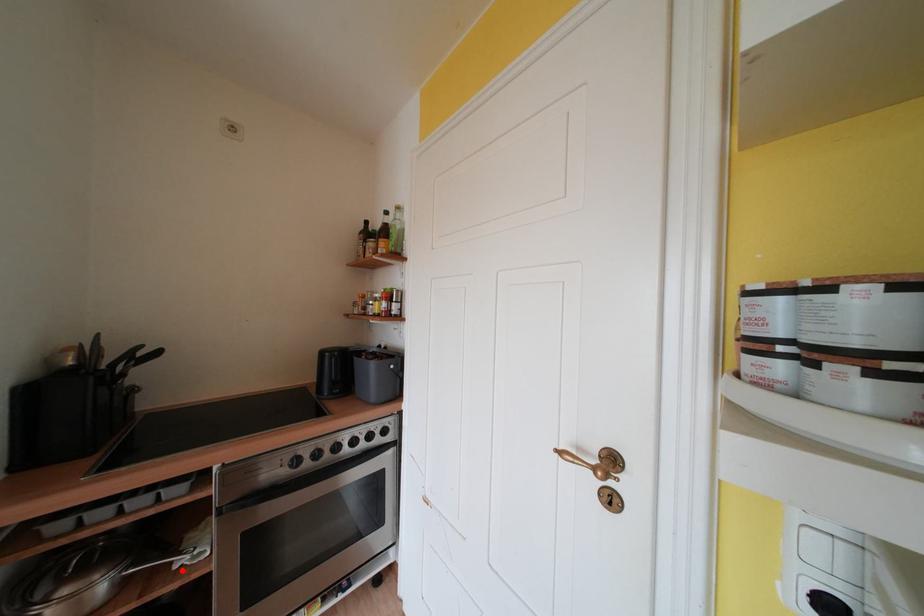
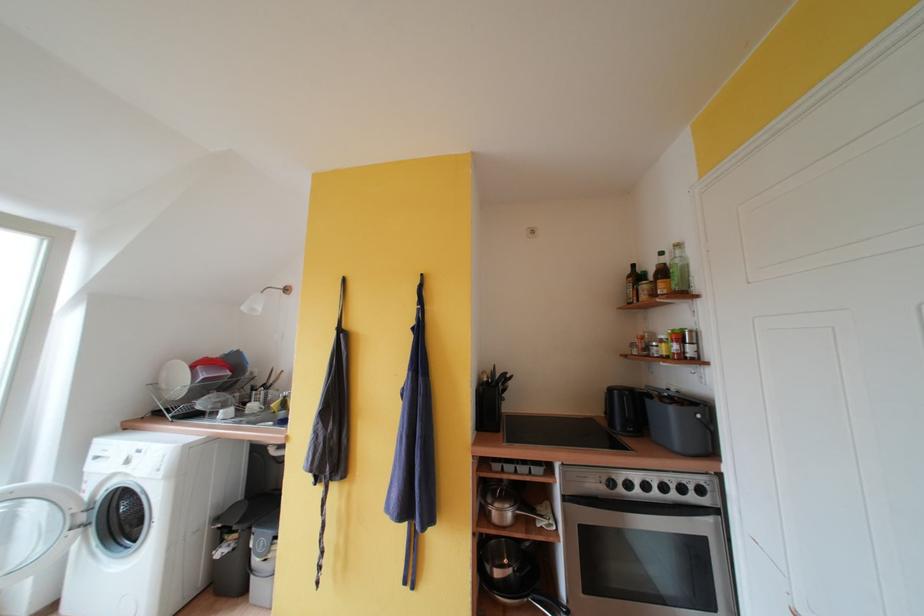
In the second image, find the point that corresponds to the highlighted location in the first image.

(544, 529)